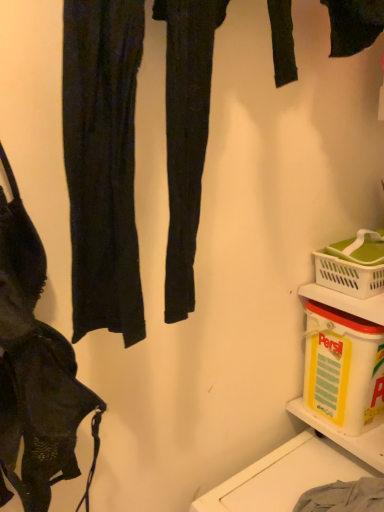
Question: Can you confirm if white plastic picnic basket at lower right is smaller than yellow plastic container at lower right?

Choices:
 (A) yes
 (B) no

Answer: (A)

Question: From the image's perspective, would you say white plastic picnic basket at lower right is positioned over yellow plastic container at lower right?

Choices:
 (A) yes
 (B) no

Answer: (A)

Question: Is white plastic picnic basket at lower right to the left of yellow plastic container at lower right from the viewer's perspective?

Choices:
 (A) yes
 (B) no

Answer: (B)

Question: From a real-world perspective, is white plastic picnic basket at lower right on yellow plastic container at lower right?

Choices:
 (A) no
 (B) yes

Answer: (B)

Question: Does white plastic picnic basket at lower right have a greater height compared to yellow plastic container at lower right?

Choices:
 (A) yes
 (B) no

Answer: (B)

Question: From the image's perspective, is white plastic picnic basket at lower right below yellow plastic container at lower right?

Choices:
 (A) yes
 (B) no

Answer: (B)

Question: Is matte black bra at left surrounded by yellow plastic container at lower right?

Choices:
 (A) yes
 (B) no

Answer: (B)

Question: Does yellow plastic container at lower right have a greater height compared to matte black bra at left?

Choices:
 (A) yes
 (B) no

Answer: (B)

Question: Is yellow plastic container at lower right smaller than matte black bra at left?

Choices:
 (A) yes
 (B) no

Answer: (A)

Question: Is yellow plastic container at lower right closer to camera compared to matte black bra at left?

Choices:
 (A) no
 (B) yes

Answer: (A)

Question: Is yellow plastic container at lower right not within matte black bra at left?

Choices:
 (A) yes
 (B) no

Answer: (A)

Question: Can you confirm if yellow plastic container at lower right is positioned to the right of matte black bra at left?

Choices:
 (A) yes
 (B) no

Answer: (A)

Question: From a real-world perspective, is gray cotton towel at lower right below matte black bra at left?

Choices:
 (A) yes
 (B) no

Answer: (A)